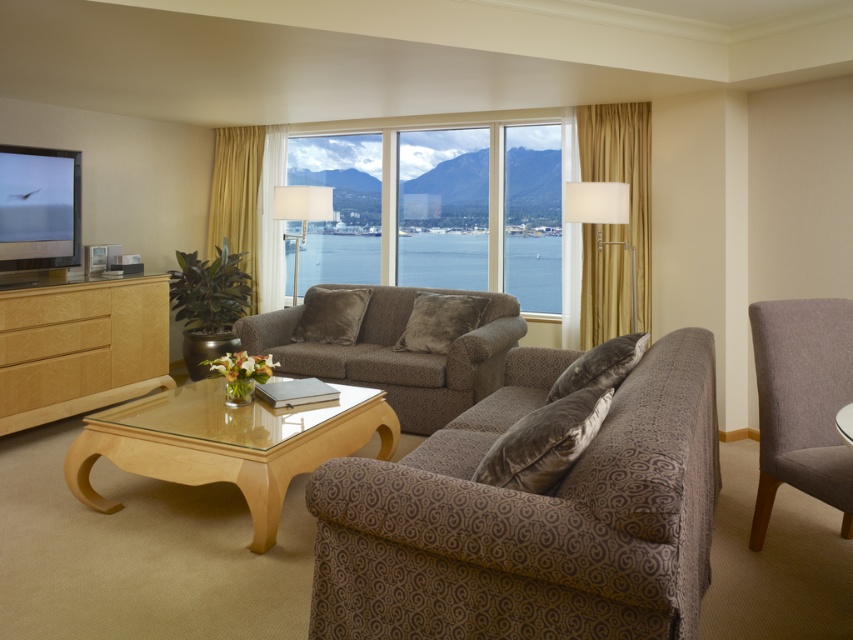
Measure the distance between gold textured curtain at right and gold textured curtain at upper left.

gold textured curtain at right is 10.72 feet from gold textured curtain at upper left.

Does gold textured curtain at right have a greater width compared to gold textured curtain at upper left?

Incorrect, gold textured curtain at right's width does not surpass gold textured curtain at upper left's.

The width and height of the screenshot is (853, 640). What do you see at coordinates (614, 225) in the screenshot?
I see `gold textured curtain at right` at bounding box center [614, 225].

Find the location of a particular element. The image size is (853, 640). gold textured curtain at right is located at coordinates (614, 225).

Can you confirm if patterned fabric couch at center is wider than clear glass coffee table at center?

Yes, patterned fabric couch at center is wider than clear glass coffee table at center.

Is patterned fabric couch at center above clear glass coffee table at center?

Yes.

Between point (637, 448) and point (334, 416), which one is positioned behind?

The point (334, 416) is behind.

I want to click on patterned fabric couch at center, so click(531, 516).

Does patterned fabric couch at center appear on the left side of matte white floor lamp at center?

In fact, patterned fabric couch at center is to the right of matte white floor lamp at center.

Measure the distance between point (x=428, y=632) and camera.

Point (x=428, y=632) and camera are 5.93 feet apart.

Where is `patterned fabric couch at center`? The width and height of the screenshot is (853, 640). patterned fabric couch at center is located at coordinates coord(531,516).

I want to click on patterned fabric couch at center, so click(531, 516).